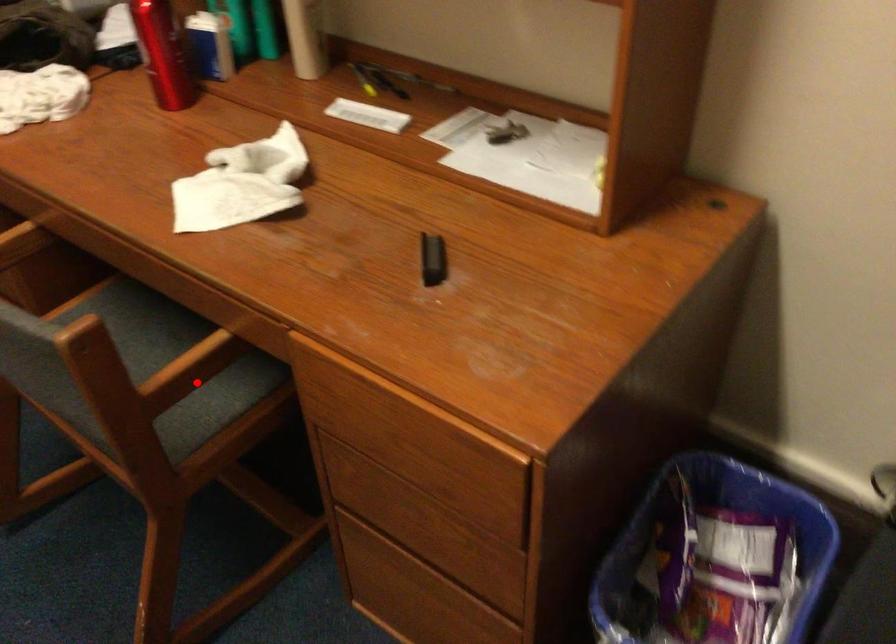
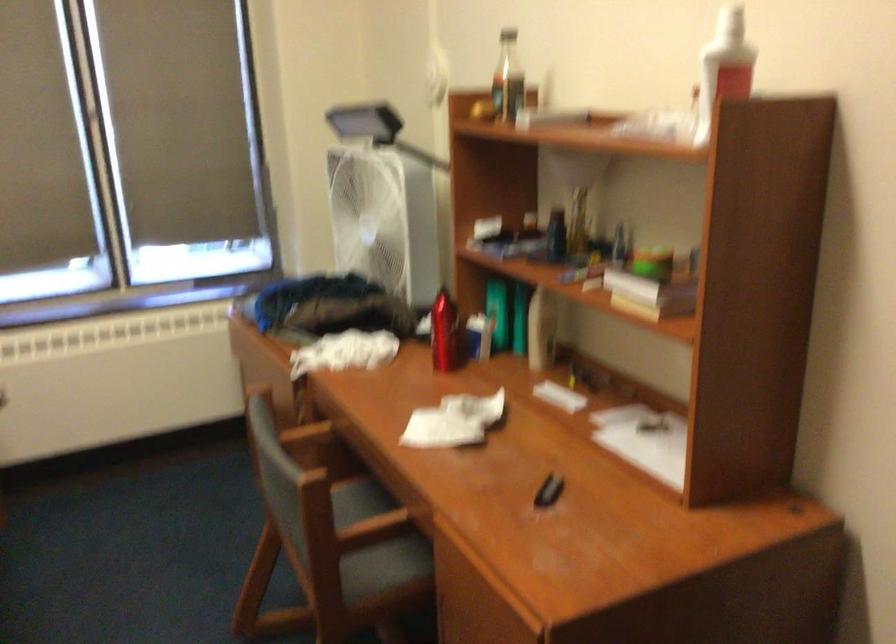
Question: A red point is marked in image1. In image2, is the corresponding 3D point closer to the camera or farther? Reply with the corresponding letter.

Choices:
 (A) The corresponding 3D point is closer.
 (B) The corresponding 3D point is farther.

Answer: (B)